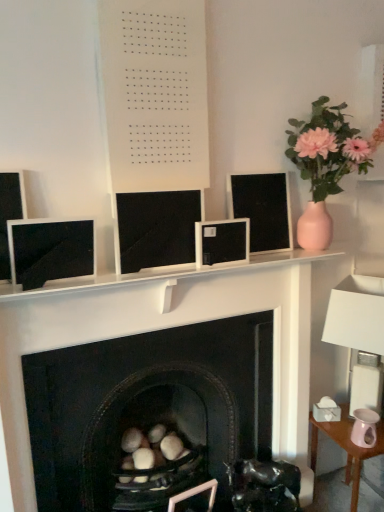
The image size is (384, 512). Identify the location of satin black frame at center, which appears as the third computer monitor when viewed from the left. (222, 242).

This screenshot has height=512, width=384. Identify the location of pink ceramic vase at upper right. (329, 148).

The image size is (384, 512). Describe the element at coordinates (359, 334) in the screenshot. I see `white fabric lampshade at right` at that location.

The height and width of the screenshot is (512, 384). Describe the element at coordinates (264, 486) in the screenshot. I see `black glossy swivel chair at center` at that location.

The image size is (384, 512). Find the location of `pink ceramic table at lower right`. pink ceramic table at lower right is located at coordinates (346, 448).

The height and width of the screenshot is (512, 384). I want to click on black matte frame at upper center, the 1th computer monitor positioned from the right, so click(x=262, y=209).

In order to click on black matte fireplace at center in this screenshot , I will do `click(171, 327)`.

This screenshot has height=512, width=384. What are the coordinates of `table lamp that is above the pink ceramic table at lower right (from a real-world perspective)` in the screenshot? It's located at (359, 334).

Is pink ceramic table at lower right in front of or behind white fabric lampshade at right in the image?

Clearly, pink ceramic table at lower right is behind white fabric lampshade at right.

Looking at this image, from the image's perspective, is pink ceramic table at lower right above or below white fabric lampshade at right?

Based on their image positions, pink ceramic table at lower right is located beneath white fabric lampshade at right.

Consider the image. From a real-world perspective, is pink ceramic table at lower right below white fabric lampshade at right?

Yes, from a real-world perspective, pink ceramic table at lower right is below white fabric lampshade at right.

Is satin black frame at center, which is counted as the 2th computer monitor, starting from the right, far away from matte black monitor at left, the first computer monitor positioned from the left?

That's not correct — satin black frame at center, which is counted as the 2th computer monitor, starting from the right, is a little close to matte black monitor at left, the first computer monitor positioned from the left.

How different are the orientations of satin black frame at center, which is counted as the 2th computer monitor, starting from the right, and matte black monitor at left, which is counted as the 4th computer monitor, starting from the right, in degrees?

satin black frame at center, which is counted as the 2th computer monitor, starting from the right, and matte black monitor at left, which is counted as the 4th computer monitor, starting from the right, are facing 0.000929 degrees away from each other.

Which of these two, satin black frame at center, which is counted as the 2th computer monitor, starting from the right, or matte black monitor at left, the first computer monitor positioned from the left, is smaller?

satin black frame at center, which is counted as the 2th computer monitor, starting from the right.

In the scene shown: Considering the positions of objects satin black frame at center, which appears as the third computer monitor when viewed from the left, and matte black monitor at left, the first computer monitor positioned from the left, in the image provided, who is in front, satin black frame at center, which appears as the third computer monitor when viewed from the left, or matte black monitor at left, the first computer monitor positioned from the left,?

matte black monitor at left, the first computer monitor positioned from the left, is closer to the camera.

Consider the image. Is black matte monitor at center, the 2th computer monitor viewed from the left, completely or partially inside black matte frame at upper center, the 1th computer monitor positioned from the right?

Definitely not — black matte monitor at center, the 2th computer monitor viewed from the left, is not inside black matte frame at upper center, the 1th computer monitor positioned from the right.

Is black matte frame at upper center, the 1th computer monitor positioned from the right, taller than black matte monitor at center, the 3th computer monitor in the right-to-left sequence?

Correct, black matte frame at upper center, the 1th computer monitor positioned from the right, is much taller as black matte monitor at center, the 3th computer monitor in the right-to-left sequence.

In the image, is black matte frame at upper center, the 1th computer monitor positioned from the right, on the left side or the right side of black matte monitor at center, the 3th computer monitor in the right-to-left sequence?

From the image, it's evident that black matte frame at upper center, the 1th computer monitor positioned from the right, is to the right of black matte monitor at center, the 3th computer monitor in the right-to-left sequence.

In terms of width, does pink ceramic table at lower right look wider or thinner when compared to black glossy swivel chair at center?

In the image, pink ceramic table at lower right appears to be wider than black glossy swivel chair at center.

How different are the orientations of pink ceramic table at lower right and black glossy swivel chair at center in degrees?

28.6 degrees.

Which object is positioned more to the left, pink ceramic table at lower right or black glossy swivel chair at center?

Positioned to the left is black glossy swivel chair at center.

Who is more distant, pink ceramic table at lower right or black glossy swivel chair at center?

pink ceramic table at lower right is behind.

Which point is more forward, (377, 402) or (330, 118)?

The point (330, 118) is closer to the camera.

Is white fabric lampshade at right oriented towards pink ceramic vase at upper right?

No.

Based on their sizes in the image, would you say white fabric lampshade at right is bigger or smaller than pink ceramic vase at upper right?

Considering their sizes, white fabric lampshade at right takes up less space than pink ceramic vase at upper right.

Is pink ceramic table at lower right positioned with its back to matte black monitor at left, the first computer monitor positioned from the left?

pink ceramic table at lower right does not have its back to matte black monitor at left, the first computer monitor positioned from the left.

Are pink ceramic table at lower right and matte black monitor at left, the first computer monitor positioned from the left, making contact?

pink ceramic table at lower right and matte black monitor at left, the first computer monitor positioned from the left, are clearly separated.

How different are the orientations of pink ceramic table at lower right and matte black monitor at left, which is counted as the 4th computer monitor, starting from the right, in degrees?

3.47 degrees separate the facing orientations of pink ceramic table at lower right and matte black monitor at left, which is counted as the 4th computer monitor, starting from the right.

How far apart are satin black frame at center, which is counted as the 2th computer monitor, starting from the right, and pink ceramic vase at upper right?

The distance of satin black frame at center, which is counted as the 2th computer monitor, starting from the right, from pink ceramic vase at upper right is 20.48 inches.

From a real-world perspective, which is physically above, satin black frame at center, which is counted as the 2th computer monitor, starting from the right, or pink ceramic vase at upper right?

pink ceramic vase at upper right is physically above.

Who is shorter, satin black frame at center, which appears as the third computer monitor when viewed from the left, or pink ceramic vase at upper right?

With less height is satin black frame at center, which appears as the third computer monitor when viewed from the left.

Is satin black frame at center, which appears as the third computer monitor when viewed from the left, not near pink ceramic vase at upper right?

Actually, satin black frame at center, which appears as the third computer monitor when viewed from the left, and pink ceramic vase at upper right are a little close together.

Where is `table lamp above the pink ceramic table at lower right (from the image's perspective)`? This screenshot has width=384, height=512. table lamp above the pink ceramic table at lower right (from the image's perspective) is located at coordinates (359, 334).

Identify the location of the 2nd computer monitor in front of the satin black frame at center, which is counted as the 2th computer monitor, starting from the right, counting from the anchor's position. This screenshot has width=384, height=512. click(x=50, y=251).

When comparing their distances from matte black monitor at left, which is counted as the 4th computer monitor, starting from the right, does white matte board at upper center or black glossy swivel chair at center seem closer?

white matte board at upper center is positioned closer to the anchor matte black monitor at left, which is counted as the 4th computer monitor, starting from the right.

Which object lies nearer to the anchor point pink ceramic vase at upper right, matte black monitor at left, which is counted as the 4th computer monitor, starting from the right, or white matte board at upper center?

The object closer to pink ceramic vase at upper right is white matte board at upper center.

Looking at the image, which one is located closer to white matte board at upper center, white fabric lampshade at right or pink ceramic table at lower right?

white fabric lampshade at right is positioned closer to the anchor white matte board at upper center.

When comparing their distances from black matte monitor at center, the 3th computer monitor in the right-to-left sequence, does black matte frame at upper center, the 4th computer monitor when ordered from left to right, or satin black frame at center, which is counted as the 2th computer monitor, starting from the right, seem closer?

satin black frame at center, which is counted as the 2th computer monitor, starting from the right.

From the image, which object appears to be nearer to black glossy swivel chair at center, white fabric lampshade at right or pink ceramic vase at upper right?

Based on the image, white fabric lampshade at right appears to be nearer to black glossy swivel chair at center.

From the image, which object appears to be farther from satin black frame at center, which is counted as the 2th computer monitor, starting from the right, white fabric lampshade at right or black matte fireplace at center?

white fabric lampshade at right is positioned further to the anchor satin black frame at center, which is counted as the 2th computer monitor, starting from the right.

When comparing their distances from pink ceramic vase at upper right, does white matte board at upper center or black matte monitor at center, the 3th computer monitor in the right-to-left sequence, seem closer?

white matte board at upper center.

From the picture: Based on their spatial positions, is white matte board at upper center or black matte frame at upper center, the 4th computer monitor when ordered from left to right, closer to pink ceramic vase at upper right?

Based on the image, black matte frame at upper center, the 4th computer monitor when ordered from left to right, appears to be nearer to pink ceramic vase at upper right.

Locate an element on the screen. The height and width of the screenshot is (512, 384). table lamp between pink ceramic vase at upper right and black matte fireplace at center from top to bottom is located at coordinates (359, 334).

Find the location of a particular element. The width and height of the screenshot is (384, 512). computer monitor between satin black frame at center, which is counted as the 2th computer monitor, starting from the right, and pink ceramic vase at upper right is located at coordinates (262, 209).

At what (x,y) coordinates should I click in order to perform the action: click on fireplace between black matte monitor at center, the 2th computer monitor viewed from the left, and white fabric lampshade at right from left to right. Please return your answer as a coordinate pair (x, y). The height and width of the screenshot is (512, 384). Looking at the image, I should click on (171, 327).

Find the location of `floral arrangement between white matte board at upper center and pink ceramic table at lower right in the up-down direction`. floral arrangement between white matte board at upper center and pink ceramic table at lower right in the up-down direction is located at coordinates (329, 148).